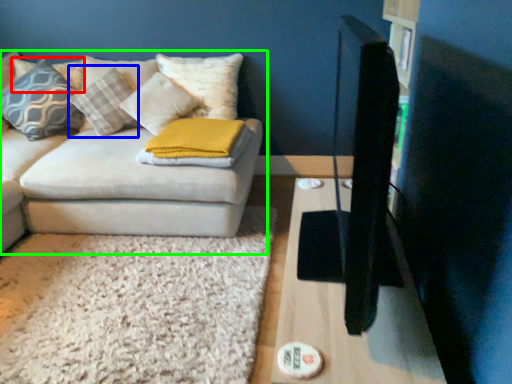
Question: Based on their relative distances, which object is farther from pillow (highlighted by a red box)? Choose from pillow (highlighted by a blue box) and studio couch (highlighted by a green box).

Choices:
 (A) pillow
 (B) studio couch

Answer: (B)